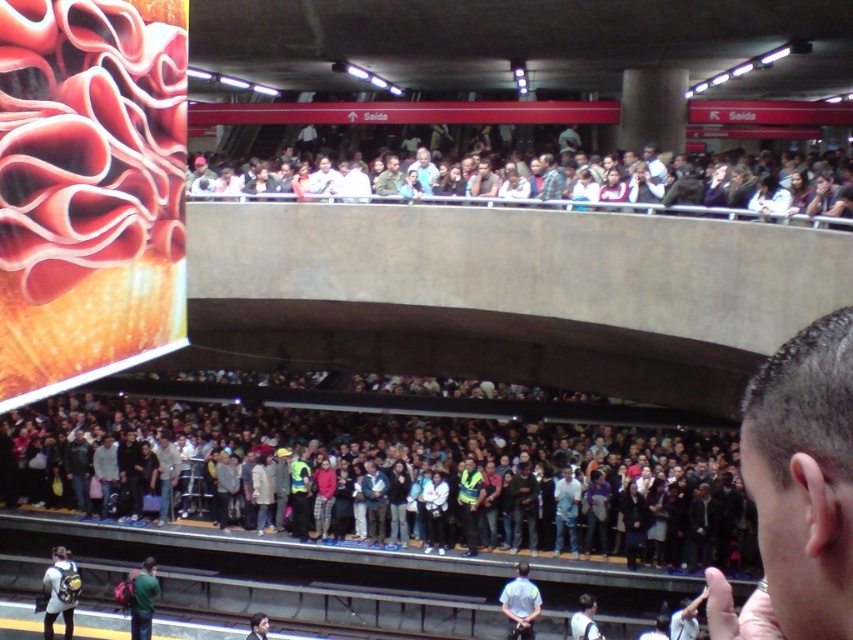
You are a photographer trying to capture a candid shot of the dark brown hair at lower right and the dark gray shirt at upper center in the crowded subway station. Considering the space each occupies, which subject would be easier to frame without including unintended elements in the photo?

The dark brown hair at lower right occupies less space than the dark gray shirt at upper center, so it would be easier to frame the dark brown hair at lower right without including unintended elements in the photo.